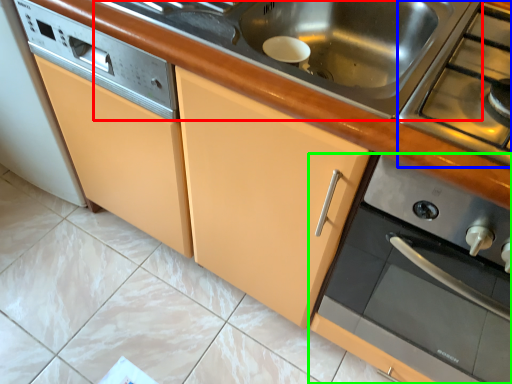
Question: Which is farther away from sink (highlighted by a red box)? gas stove (highlighted by a blue box) or home appliance (highlighted by a green box)?

Choices:
 (A) gas stove
 (B) home appliance

Answer: (B)